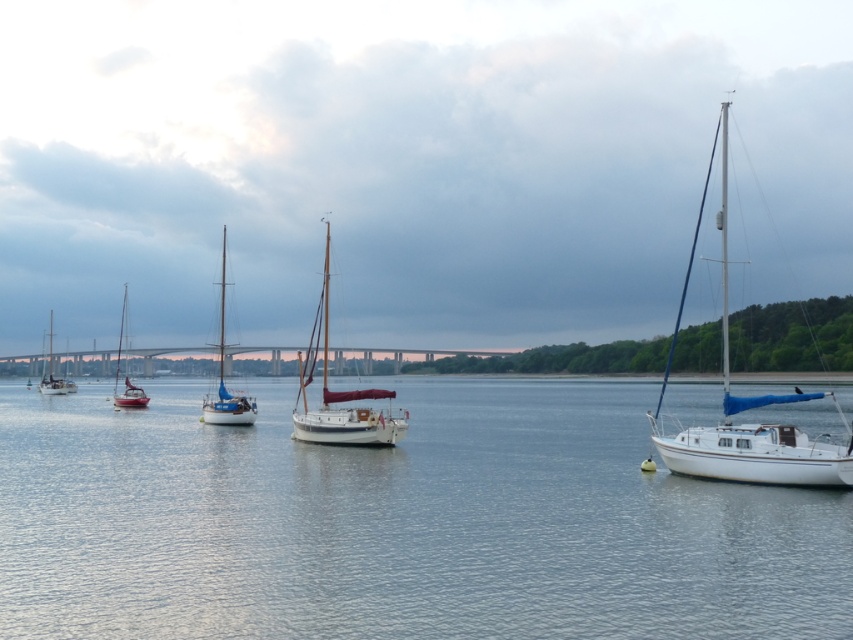
Question: Does smooth water at center have a lesser width compared to white matte sailboat at center?

Choices:
 (A) no
 (B) yes

Answer: (A)

Question: Which point is closer to the camera taking this photo?

Choices:
 (A) [x=735, y=464]
 (B) [x=44, y=376]
 (C) [x=132, y=401]
 (D) [x=351, y=422]

Answer: (A)

Question: Is smooth water at center to the left of wooden sailboat at center from the viewer's perspective?

Choices:
 (A) yes
 (B) no

Answer: (B)

Question: Estimate the real-world distances between objects in this image. Which object is closer to the matte white sailboat at left?

Choices:
 (A) white matte sailboat at center
 (B) smooth water at center
 (C) wooden sailboat at center

Answer: (B)

Question: Is smooth water at center positioned in front of white matte sailboat at center?

Choices:
 (A) no
 (B) yes

Answer: (B)

Question: Which object is closer to the camera taking this photo?

Choices:
 (A) white matte sailboat at center
 (B) smooth water at center
 (C) white matte sailboat at right

Answer: (B)